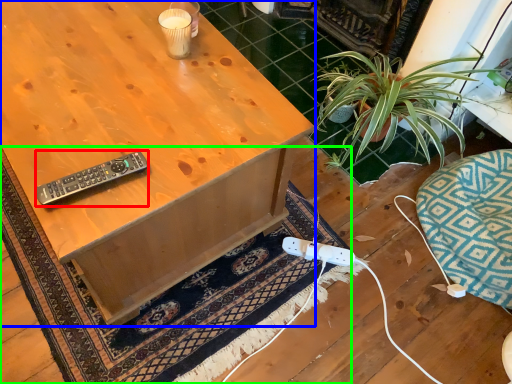
Question: Which object is the farthest from remote control (highlighted by a red box)? Choose among these: desk (highlighted by a blue box) or doormat (highlighted by a green box).

Choices:
 (A) desk
 (B) doormat

Answer: (B)